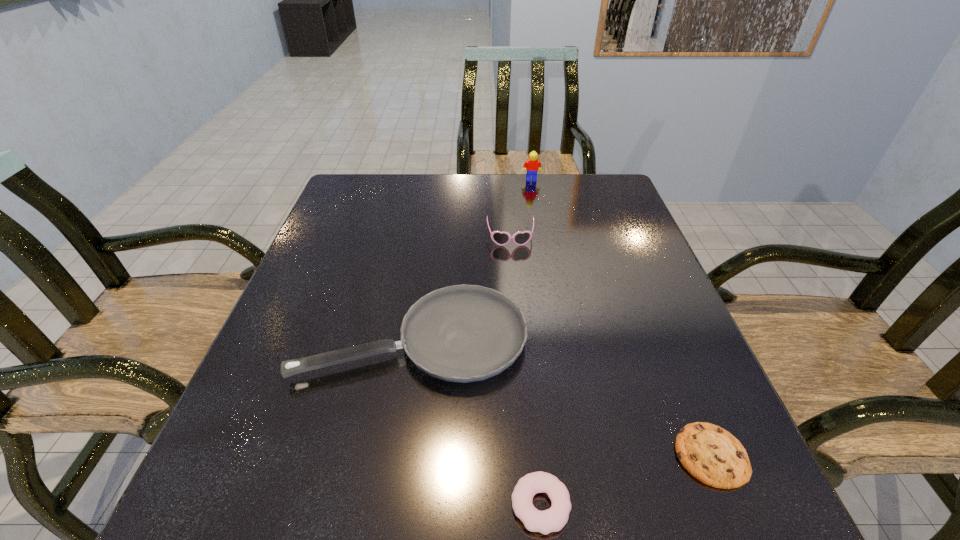
I want to click on Lego, so click(532, 164).

Where is `the tallest object`? Image resolution: width=960 pixels, height=540 pixels. the tallest object is located at coordinates (532, 164).

The width and height of the screenshot is (960, 540). In order to click on sunglasses in this screenshot , I will do `click(500, 238)`.

Locate an element on the screen. The height and width of the screenshot is (540, 960). frying pan is located at coordinates (463, 333).

Identify the location of the third tallest object. The height and width of the screenshot is (540, 960). (463, 333).

At what (x,y) coordinates should I click in order to perform the action: click on doughnut. Please return your answer as a coordinate pair (x, y). This screenshot has height=540, width=960. Looking at the image, I should click on (553, 519).

This screenshot has height=540, width=960. In order to click on the rightmost object in this screenshot , I will do pos(711,454).

Locate an element on the screen. the shortest object is located at coordinates (711, 454).

Find the location of a particular element. The height and width of the screenshot is (540, 960). vacant space situated 0.070m on the front-facing side of the farthest object is located at coordinates (534, 193).

What are the coordinates of `free space located on the front-facing side of the fourth nearest object` in the screenshot? It's located at (513, 266).